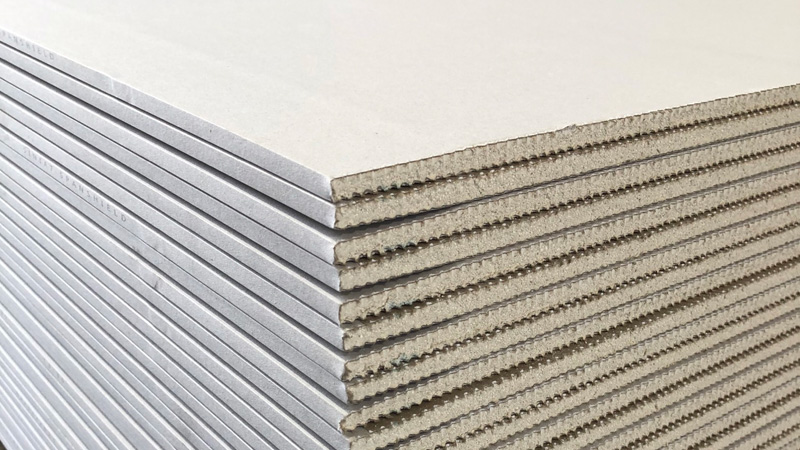
Find the location of a particular element. The height and width of the screenshot is (450, 800). sheet #6 is located at coordinates (296, 315).